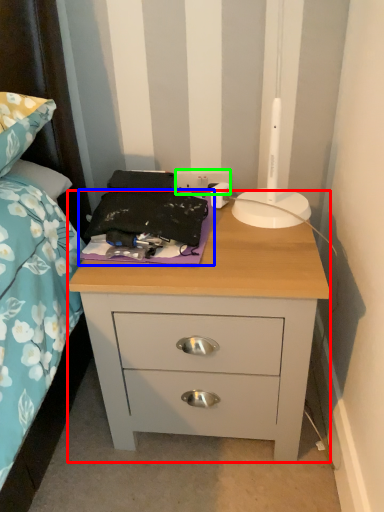
Question: Which object is the farthest from nightstand (highlighted by a red box)? Choose among these: sheet (highlighted by a blue box) or electric outlet (highlighted by a green box).

Choices:
 (A) sheet
 (B) electric outlet

Answer: (B)